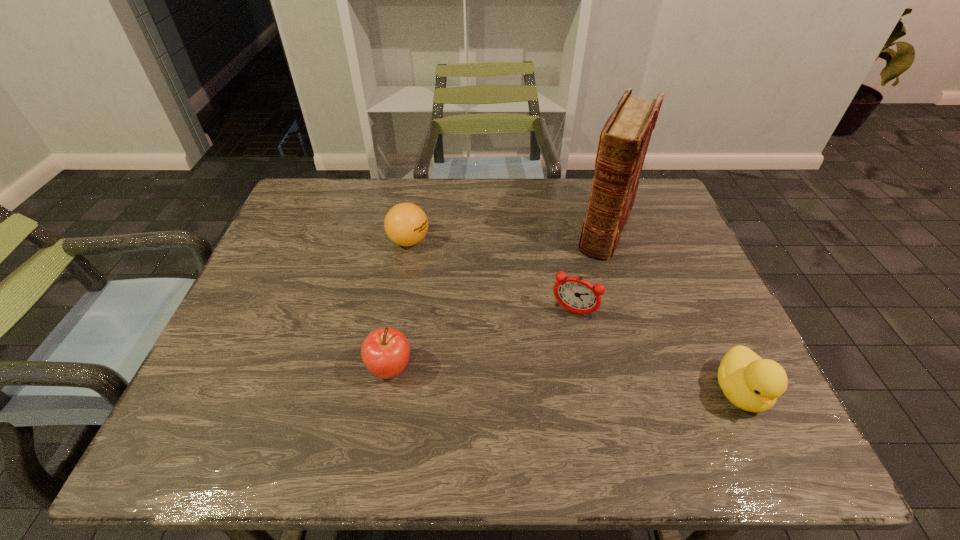
This screenshot has height=540, width=960. In order to click on vacant space that is in between the hardback book and the ping-pong ball in this screenshot , I will do `click(508, 235)`.

Identify the location of free space that is in between the apple and the tallest object. (498, 299).

At what (x,y) coordinates should I click in order to perform the action: click on free spot between the alarm clock and the hardback book. Please return your answer as a coordinate pair (x, y). The height and width of the screenshot is (540, 960). Looking at the image, I should click on (589, 271).

Locate an element on the screen. vacant space in between the third nearest object and the ping-pong ball is located at coordinates (492, 277).

Where is `free space between the third nearest object and the rightmost object`? This screenshot has width=960, height=540. free space between the third nearest object and the rightmost object is located at coordinates (657, 352).

Where is `free space that is in between the apple and the rightmost object`? free space that is in between the apple and the rightmost object is located at coordinates (564, 380).

Identify the location of blank region between the ping-pong ball and the tallest object. tap(508, 235).

The image size is (960, 540). What are the coordinates of `empty space that is in between the third farthest object and the apple` in the screenshot? It's located at (482, 340).

This screenshot has width=960, height=540. Identify the location of empty space between the ping-pong ball and the rightmost object. (574, 316).

Point out which object is positioned as the second nearest to the apple. Please provide its 2D coordinates. Your answer should be formatted as a tuple, i.e. [(x, y)], where the tuple contains the x and y coordinates of a point satisfying the conditions above.

[(576, 295)]